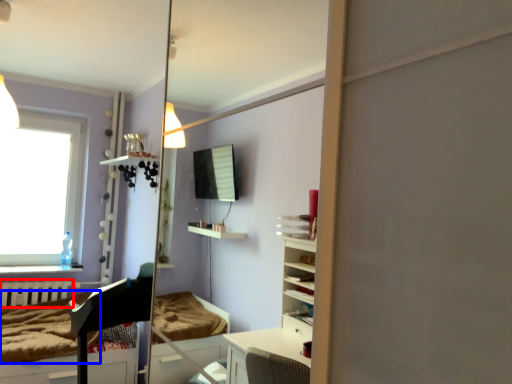
Question: Which point is closer to the camera, radiator (highlighted by a red box) or mattress (highlighted by a blue box)?

Choices:
 (A) radiator
 (B) mattress

Answer: (B)